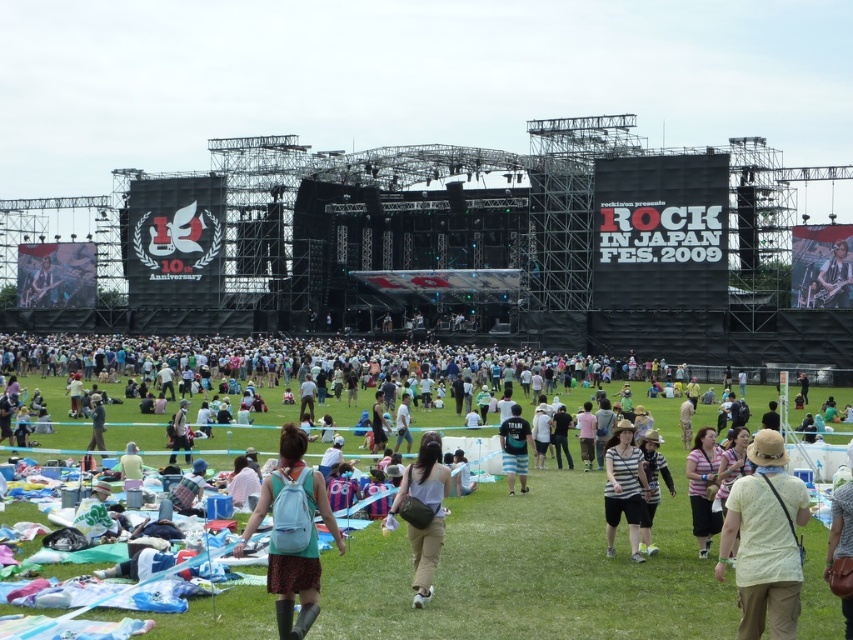
Does light blue fabric backpack at center have a greater height compared to light brown fabric pants at center?

Correct, light blue fabric backpack at center is much taller as light brown fabric pants at center.

Who is more distant from viewer, (281,636) or (425,518)?

The point (425,518) is behind.

Is point (320, 508) farther from viewer compared to point (426, 529)?

That is False.

Identify the location of light blue fabric backpack at center. Image resolution: width=853 pixels, height=640 pixels. (x=293, y=532).

Who is shorter, light beige cotton shirt at center or striped cotton shirt at center?

With less height is striped cotton shirt at center.

I want to click on light beige cotton shirt at center, so click(764, 540).

Can you confirm if light beige cotton shirt at center is positioned above light brown fabric pants at center?

Actually, light beige cotton shirt at center is below light brown fabric pants at center.

Is light beige cotton shirt at center to the right of light brown fabric pants at center from the viewer's perspective?

Correct, you'll find light beige cotton shirt at center to the right of light brown fabric pants at center.

Identify the location of light beige cotton shirt at center. The image size is (853, 640). (764, 540).

Where is `light beige cotton shirt at center`? light beige cotton shirt at center is located at coordinates (764, 540).